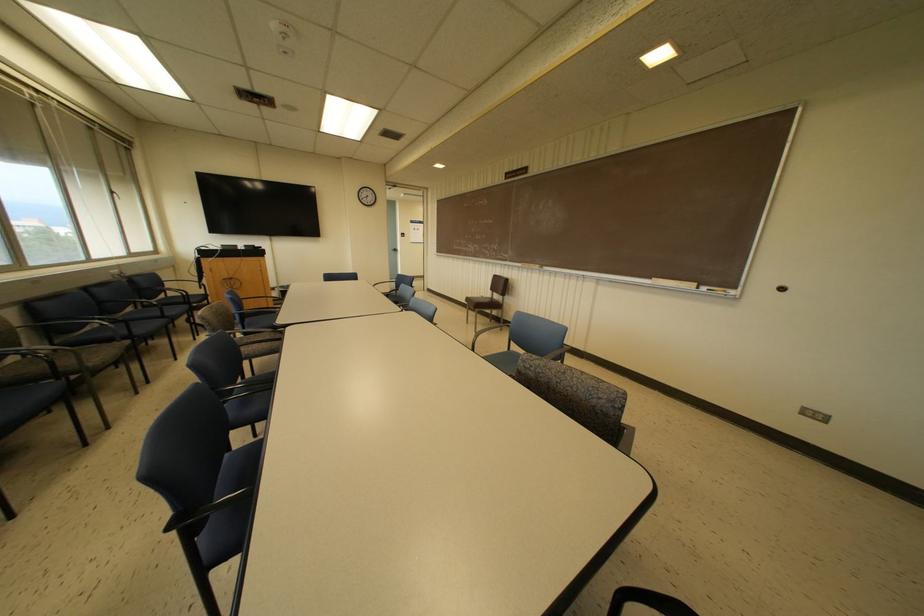
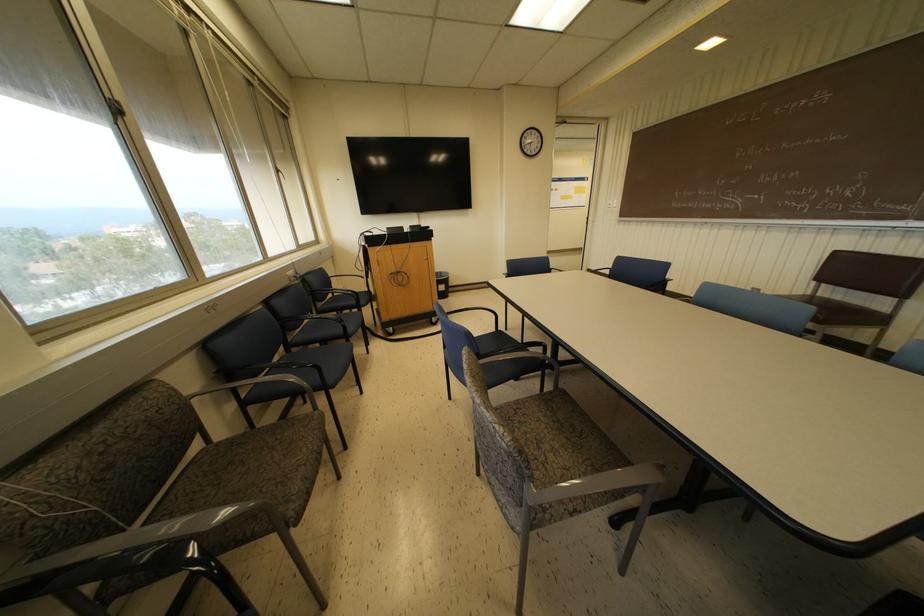
Find the pixel in the second image that matches pixel 508 270 in the first image.

(914, 240)